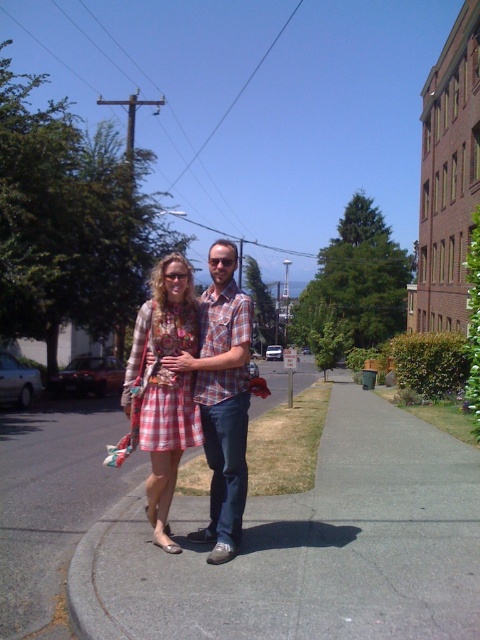
You are standing on the sidewalk and see the point marked at coordinates (x=222, y=397). What object is located at that point?

The point at coordinates (x=222, y=397) marks the plaid shirt at center.

You are a delivery person carrying a box that is 1.5 meters tall. You need to walk through the path between the gray asphalt sidewalk at center and the plaid shirt at center. Can the box fit through the path?

The gray asphalt sidewalk at center has a lesser height compared to plaid shirt at center, so the path between them is at least as tall as the plaid shirt at center. Since the box is 1.5 meters tall, it may not fit if the plaid shirt at center is taller than 1.5 meters. However, without knowing the exact height of the plaid shirt at center, it is impossible to determine for certain.